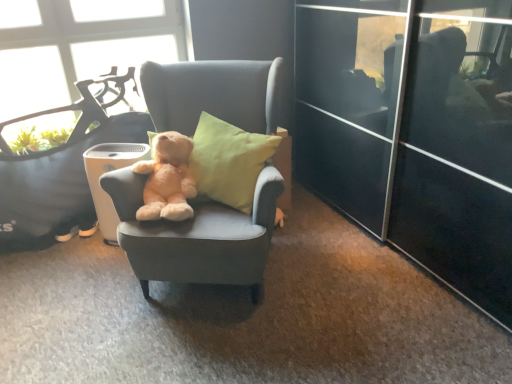
What is the approximate height of soft gray fabric chair at center, which ranks as the second chair in right-to-left order?

soft gray fabric chair at center, which ranks as the second chair in right-to-left order, is 38.19 inches tall.

This screenshot has height=384, width=512. What do you see at coordinates (79, 47) in the screenshot? I see `transparent glass window at upper left` at bounding box center [79, 47].

Locate an element on the screen. This screenshot has width=512, height=384. white plastic trash bin/can at center is located at coordinates (106, 172).

The height and width of the screenshot is (384, 512). What do you see at coordinates (106, 172) in the screenshot?
I see `white plastic trash bin/can at center` at bounding box center [106, 172].

At what (x,y) coordinates should I click in order to perform the action: click on soft gray fabric chair at center, the first chair when ordered from right to left. Please return your answer as a coordinate pair (x, y). Image resolution: width=512 pixels, height=384 pixels. Looking at the image, I should click on (197, 236).

Locate an element on the screen. The height and width of the screenshot is (384, 512). soft gray fabric chair at center, the first chair when ordered from left to right is located at coordinates (60, 172).

Is soft beige teddy bear at center wider than white plastic trash bin/can at center?

Yes, soft beige teddy bear at center is wider than white plastic trash bin/can at center.

Is soft beige teddy bear at center further to camera compared to white plastic trash bin/can at center?

No, the depth of soft beige teddy bear at center is less than that of white plastic trash bin/can at center.

Measure the distance from soft beige teddy bear at center to white plastic trash bin/can at center.

soft beige teddy bear at center and white plastic trash bin/can at center are 12.72 inches apart from each other.

Is soft beige teddy bear at center located outside white plastic trash bin/can at center?

Yes, soft beige teddy bear at center is located beyond the bounds of white plastic trash bin/can at center.

Are transparent glass window at upper left and soft beige teddy bear at center beside each other?

No.

Which object is positioned more to the right, transparent glass window at upper left or soft beige teddy bear at center?

soft beige teddy bear at center.

Considering the sizes of objects transparent glass window at upper left and soft beige teddy bear at center in the image provided, who is shorter, transparent glass window at upper left or soft beige teddy bear at center?

With less height is soft beige teddy bear at center.

Can you confirm if soft beige teddy bear at center is taller than soft gray fabric chair at center, the first chair when ordered from left to right?

In fact, soft beige teddy bear at center may be shorter than soft gray fabric chair at center, the first chair when ordered from left to right.

Is soft beige teddy bear at center not within soft gray fabric chair at center, the first chair when ordered from left to right?

Indeed, soft beige teddy bear at center is completely outside soft gray fabric chair at center, the first chair when ordered from left to right.

Is soft beige teddy bear at center positioned with its back to soft gray fabric chair at center, which ranks as the second chair in right-to-left order?

That's right, soft beige teddy bear at center is facing away from soft gray fabric chair at center, which ranks as the second chair in right-to-left order.

Considering the sizes of soft beige teddy bear at center and soft gray fabric chair at center, the first chair when ordered from left to right, in the image, is soft beige teddy bear at center wider or thinner than soft gray fabric chair at center, the first chair when ordered from left to right,?

In the image, soft beige teddy bear at center appears to be wider than soft gray fabric chair at center, the first chair when ordered from left to right.

Is point (10, 218) behind point (163, 186)?

That is True.

Which of these two, soft gray fabric chair at center, which ranks as the second chair in right-to-left order, or soft beige teddy bear at center, is thinner?

With smaller width is soft gray fabric chair at center, which ranks as the second chair in right-to-left order.

Is soft gray fabric chair at center, the first chair when ordered from left to right, positioned in front of soft beige teddy bear at center?

No, soft gray fabric chair at center, the first chair when ordered from left to right, is further to the viewer.

Is soft beige teddy bear at center surrounded by soft gray fabric chair at center, which ranks as the second chair in right-to-left order?

No.

Does soft gray fabric chair at center, the first chair when ordered from right to left, have a greater height compared to transparent glass window at upper left?

Yes.

Looking at their sizes, would you say soft gray fabric chair at center, the first chair when ordered from right to left, is wider or thinner than transparent glass window at upper left?

Clearly, soft gray fabric chair at center, the first chair when ordered from right to left, has more width compared to transparent glass window at upper left.

Is soft gray fabric chair at center, which ranks as the second chair in left-to-right order, aimed at transparent glass window at upper left?

No, soft gray fabric chair at center, which ranks as the second chair in left-to-right order, is not facing towards transparent glass window at upper left.

Looking at their sizes, would you say soft beige teddy bear at center is wider or thinner than transparent glass window at upper left?

Clearly, soft beige teddy bear at center has more width compared to transparent glass window at upper left.

Is soft beige teddy bear at center not near transparent glass window at upper left?

No, there isn't a large distance between soft beige teddy bear at center and transparent glass window at upper left.

Is soft beige teddy bear at center in front of transparent glass window at upper left?

Yes, soft beige teddy bear at center is closer to the camera.

Considering the sizes of soft gray fabric chair at center, the first chair when ordered from right to left, and soft beige teddy bear at center in the image, is soft gray fabric chair at center, the first chair when ordered from right to left, wider or thinner than soft beige teddy bear at center?

Considering their sizes, soft gray fabric chair at center, the first chair when ordered from right to left, looks broader than soft beige teddy bear at center.

Locate an element on the screen. teddy bear above the soft gray fabric chair at center, which ranks as the second chair in left-to-right order (from the image's perspective) is located at coordinates (167, 179).

Measure the distance from soft gray fabric chair at center, the first chair when ordered from right to left, to soft beige teddy bear at center.

5.95 inches.

Where is `teddy bear above the white plastic trash bin/can at center (from the image's perspective)`? teddy bear above the white plastic trash bin/can at center (from the image's perspective) is located at coordinates (167, 179).

Where is `window that appears behind the soft beige teddy bear at center`? window that appears behind the soft beige teddy bear at center is located at coordinates (79, 47).

From the image, which object appears to be farther from soft beige teddy bear at center, soft gray fabric chair at center, the first chair when ordered from right to left, or white plastic trash bin/can at center?

Among the two, white plastic trash bin/can at center is located further to soft beige teddy bear at center.

Estimate the real-world distances between objects in this image. Which object is closer to transparent glass window at upper left, white plastic trash bin/can at center or soft gray fabric chair at center, the first chair when ordered from left to right?

soft gray fabric chair at center, the first chair when ordered from left to right, lies closer to transparent glass window at upper left than the other object.

Consider the image. Based on their spatial positions, is soft gray fabric chair at center, the first chair when ordered from right to left, or soft beige teddy bear at center further from soft gray fabric chair at center, the first chair when ordered from left to right?

soft gray fabric chair at center, the first chair when ordered from right to left, is positioned further to the anchor soft gray fabric chair at center, the first chair when ordered from left to right.

Estimate the real-world distances between objects in this image. Which object is further from transparent glass window at upper left, soft gray fabric chair at center, which ranks as the second chair in left-to-right order, or white plastic trash bin/can at center?

Based on the image, soft gray fabric chair at center, which ranks as the second chair in left-to-right order, appears to be further to transparent glass window at upper left.

Estimate the real-world distances between objects in this image. Which object is further from soft gray fabric chair at center, which ranks as the second chair in left-to-right order, soft gray fabric chair at center, the first chair when ordered from left to right, or soft beige teddy bear at center?

Based on the image, soft gray fabric chair at center, the first chair when ordered from left to right, appears to be further to soft gray fabric chair at center, which ranks as the second chair in left-to-right order.

Which object lies nearer to the anchor point soft gray fabric chair at center, the first chair when ordered from left to right, transparent glass window at upper left or soft gray fabric chair at center, which ranks as the second chair in left-to-right order?

transparent glass window at upper left is closer to soft gray fabric chair at center, the first chair when ordered from left to right.

Which object lies further to the anchor point soft gray fabric chair at center, which ranks as the second chair in right-to-left order, white plastic trash bin/can at center or soft beige teddy bear at center?

Among the two, soft beige teddy bear at center is located further to soft gray fabric chair at center, which ranks as the second chair in right-to-left order.

When comparing their distances from transparent glass window at upper left, does soft gray fabric chair at center, which ranks as the second chair in left-to-right order, or soft gray fabric chair at center, which ranks as the second chair in right-to-left order, seem closer?

Based on the image, soft gray fabric chair at center, which ranks as the second chair in right-to-left order, appears to be nearer to transparent glass window at upper left.

What are the coordinates of `chair situated between transparent glass window at upper left and soft gray fabric chair at center, the first chair when ordered from right to left, from left to right` in the screenshot? It's located at (60, 172).

Image resolution: width=512 pixels, height=384 pixels. Find the location of `teddy bear between transparent glass window at upper left and white plastic trash bin/can at center in the vertical direction`. teddy bear between transparent glass window at upper left and white plastic trash bin/can at center in the vertical direction is located at coordinates (167, 179).

Where is `trash bin/can positioned between soft gray fabric chair at center, the first chair when ordered from right to left, and transparent glass window at upper left from near to far`? trash bin/can positioned between soft gray fabric chair at center, the first chair when ordered from right to left, and transparent glass window at upper left from near to far is located at coordinates (106, 172).

Where is `chair positioned between soft gray fabric chair at center, the first chair when ordered from right to left, and white plastic trash bin/can at center from near to far`? The image size is (512, 384). chair positioned between soft gray fabric chair at center, the first chair when ordered from right to left, and white plastic trash bin/can at center from near to far is located at coordinates (60, 172).